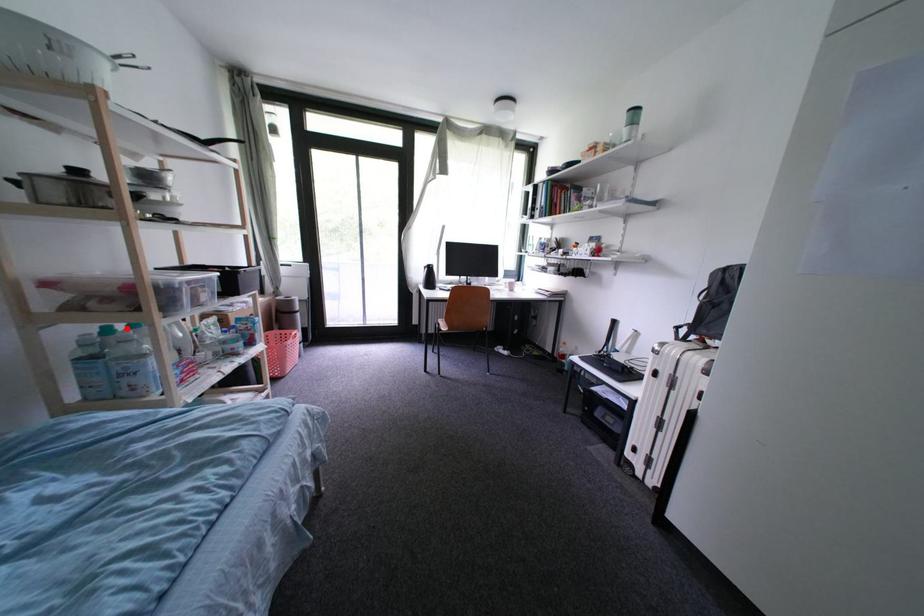
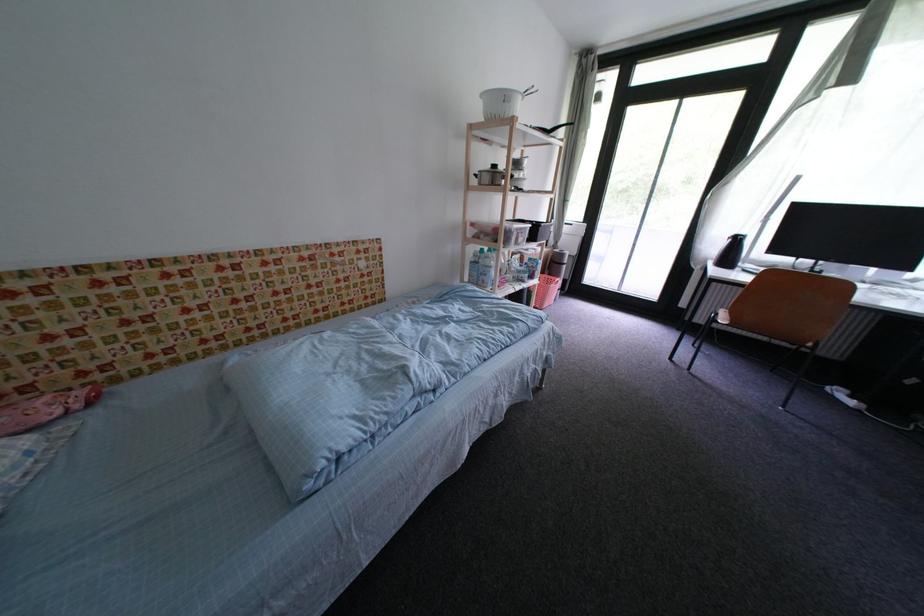
Question: I am providing you with two images of the same scene from different viewpoints. Given a red point in image1, look at the same physical point in image2. Is it:

Choices:
 (A) Closer to the viewpoint
 (B) Farther from the viewpoint

Answer: (A)